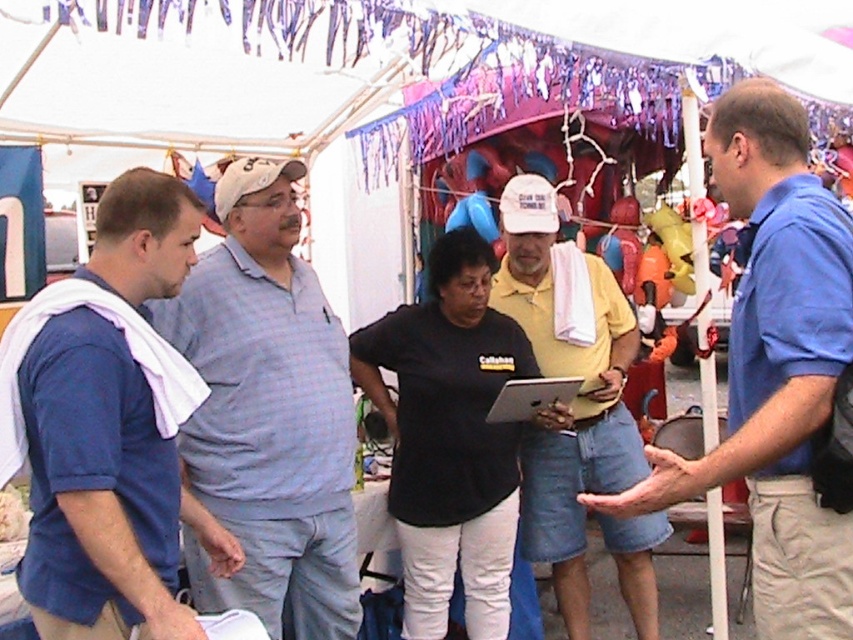
Question: Does light blue plaid shirt at center appear on the right side of yellow cotton shirt at center?

Choices:
 (A) yes
 (B) no

Answer: (B)

Question: Can you confirm if black matte shirt at center is positioned to the left of matte black laptop at center?

Choices:
 (A) no
 (B) yes

Answer: (B)

Question: Which of the following is the farthest from the observer?

Choices:
 (A) (39, 509)
 (B) (370, 392)

Answer: (B)

Question: Among these objects, which one is farthest from the camera?

Choices:
 (A) light blue plaid shirt at center
 (B) blue cotton shirt at right

Answer: (A)

Question: Which point appears closest to the camera in this image?

Choices:
 (A) (577, 392)
 (B) (180, 188)
 (C) (416, 608)
 (D) (242, 458)

Answer: (B)

Question: Can you confirm if blue cotton shirt at left is smaller than blue cotton shirt at right?

Choices:
 (A) yes
 (B) no

Answer: (A)